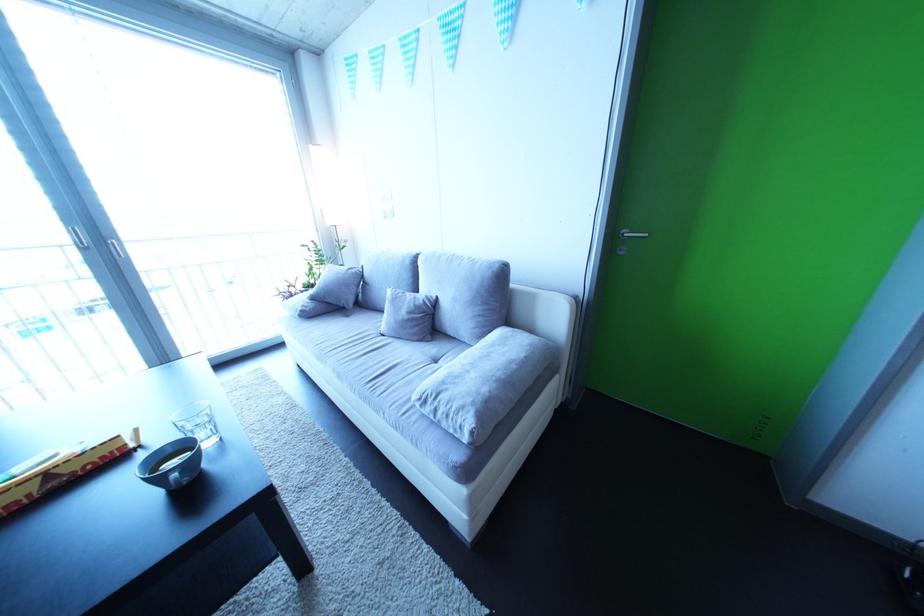
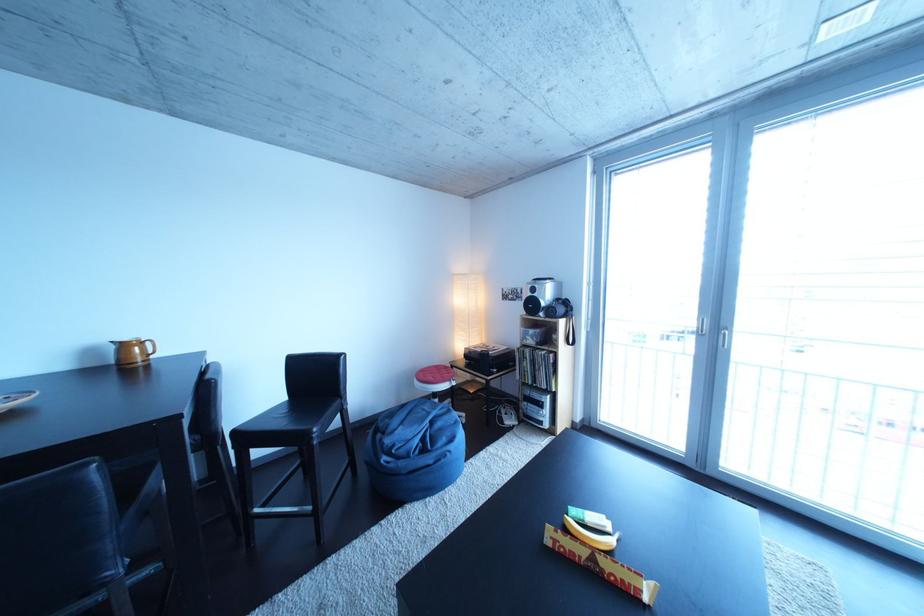
Locate, in the second image, the point that corresponds to point (128, 243) in the first image.

(743, 334)